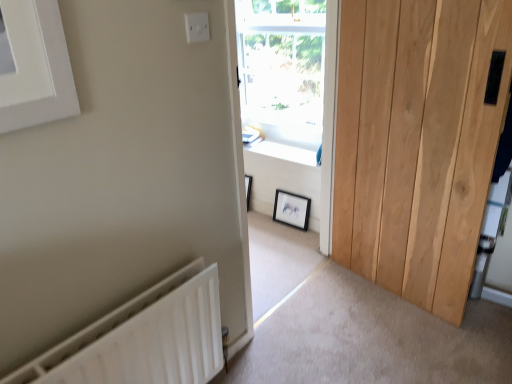
In order to click on vacant point above white matte radiator at lower left (from a real-world perspective) in this screenshot , I will do `click(113, 321)`.